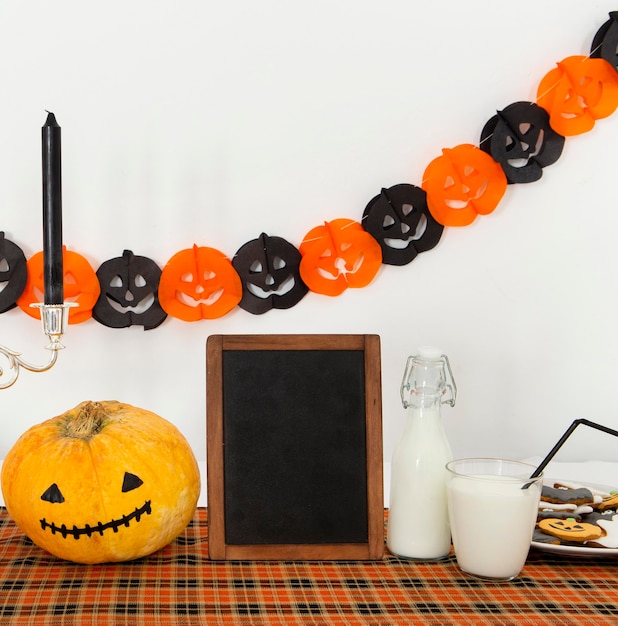
Find the location of a particular element. This screenshot has width=618, height=626. chalkboard is located at coordinates pos(303,459).